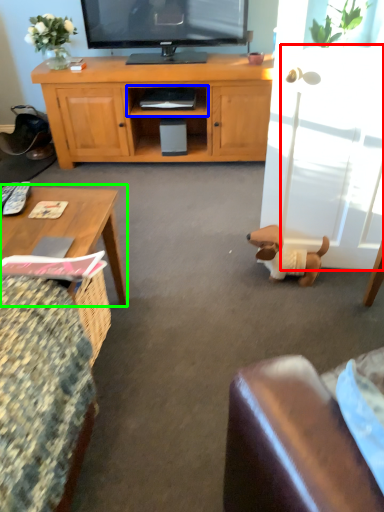
Question: Estimate the real-world distances between objects in this image. Which object is farther from glass door (highlighted by a red box), shelf (highlighted by a blue box) or coffee table (highlighted by a green box)?

Choices:
 (A) shelf
 (B) coffee table

Answer: (A)